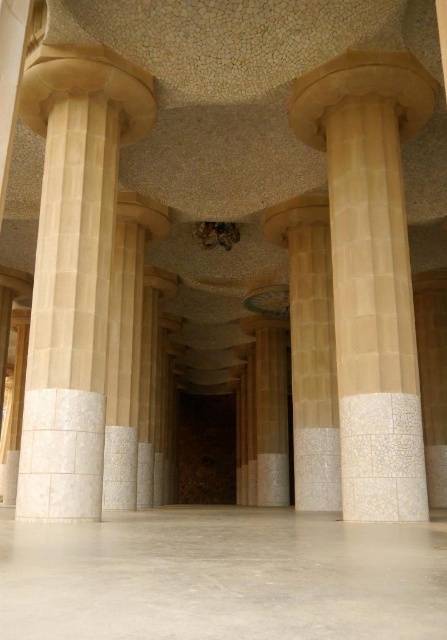
Question: Is beige marble column at center to the right of beige stone column at left from the viewer's perspective?

Choices:
 (A) yes
 (B) no

Answer: (A)

Question: Among these objects, which one is nearest to the camera?

Choices:
 (A) beige stone column at left
 (B) beige marble column at center
 (C) beige stone column at center

Answer: (B)

Question: Which point is farther to the camera?

Choices:
 (A) (265, 212)
 (B) (417, 419)
 (C) (79, 360)

Answer: (A)

Question: Does beige marble column at center come behind beige stone column at center?

Choices:
 (A) no
 (B) yes

Answer: (A)

Question: Considering the real-world distances, which object is farthest from the beige stone column at center?

Choices:
 (A) beige marble column at center
 (B) beige stone column at left

Answer: (B)

Question: Is beige marble column at center bigger than beige stone column at center?

Choices:
 (A) no
 (B) yes

Answer: (A)